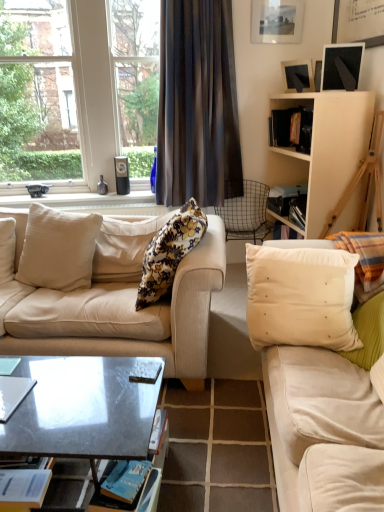
Question: Is matte black picture frame at upper right taller or shorter than white fabric pillow at right, which is the 1th pillow from right to left?

Choices:
 (A) tall
 (B) short

Answer: (B)

Question: Is point (299, 88) closer or farther from the camera than point (380, 266)?

Choices:
 (A) farther
 (B) closer

Answer: (A)

Question: Based on their relative distances, which object is farther from the blue paper magazine at lower left, placed as the second magazine when sorted from top to bottom?

Choices:
 (A) white fabric pillow at right, marked as the fourth pillow in a left-to-right arrangement
 (B) metallic gray coffee table at center
 (C) floral fabric pillow at center, acting as the third pillow starting from the right
 (D) matte cream pillow at right, marked as the second studio couch in a left-to-right arrangement
 (E) clear glass window at upper left

Answer: (E)

Question: Considering the real-world distances, which object is closest to the white matte cabinet at upper right?

Choices:
 (A) white fabric pillow at right, marked as the fourth pillow in a left-to-right arrangement
 (B) metallic gray coffee table at center
 (C) blue paper magazine at lower left, marked as the 1th magazine in a bottom-to-top arrangement
 (D) matte black picture frame at upper right
 (E) beige fabric pillow at left, which ranks as the fourth pillow in right-to-left order

Answer: (A)